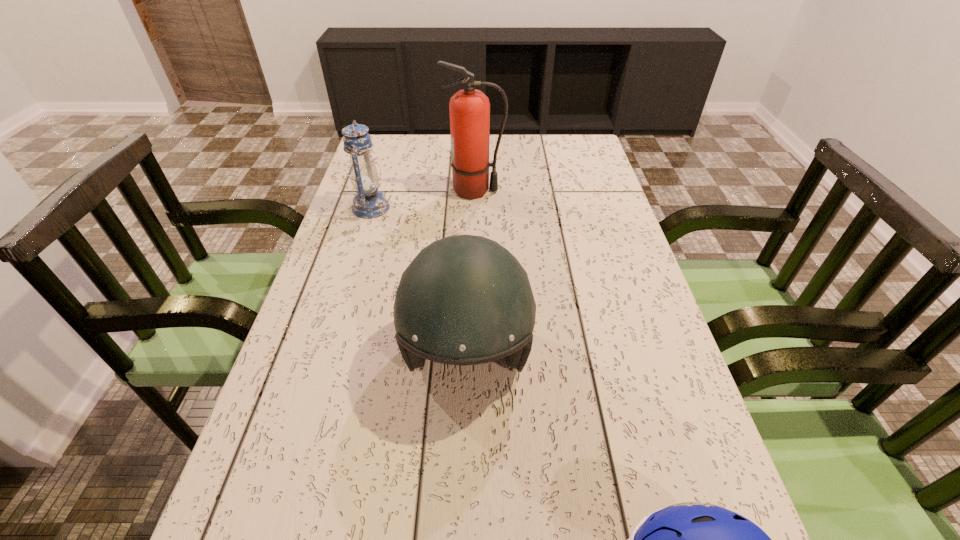
Locate an element on the screen. the tallest object is located at coordinates (469, 109).

Image resolution: width=960 pixels, height=540 pixels. Identify the location of the farther football helmet. click(464, 300).

You are a GUI agent. You are given a task and a screenshot of the screen. Output one action in this format:
    pyautogui.click(x=<x>, y=<y>)
    Task: Click on the taller football helmet
    
    Given the screenshot: What is the action you would take?
    pyautogui.click(x=464, y=300)

This screenshot has width=960, height=540. I want to click on lantern, so click(368, 203).

Identify the location of free space located on the nozzle of the tallest object. (521, 191).

At what (x,y) coordinates should I click in order to perform the action: click on vacant space positioned at the face opening of the farther football helmet. Please return your answer as a coordinate pair (x, y). Looking at the image, I should click on tap(462, 537).

What are the coordinates of `free point located 0.090m on the front-facing side of the lantern` in the screenshot? It's located at (420, 208).

Image resolution: width=960 pixels, height=540 pixels. What are the coordinates of `object present at the left edge` in the screenshot? It's located at (368, 203).

This screenshot has width=960, height=540. In the image, there is a desktop. In order to click on vacant space at the far edge in this screenshot , I will do `click(528, 136)`.

Locate an element on the screen. This screenshot has width=960, height=540. vacant area at the left edge of the desktop is located at coordinates (381, 265).